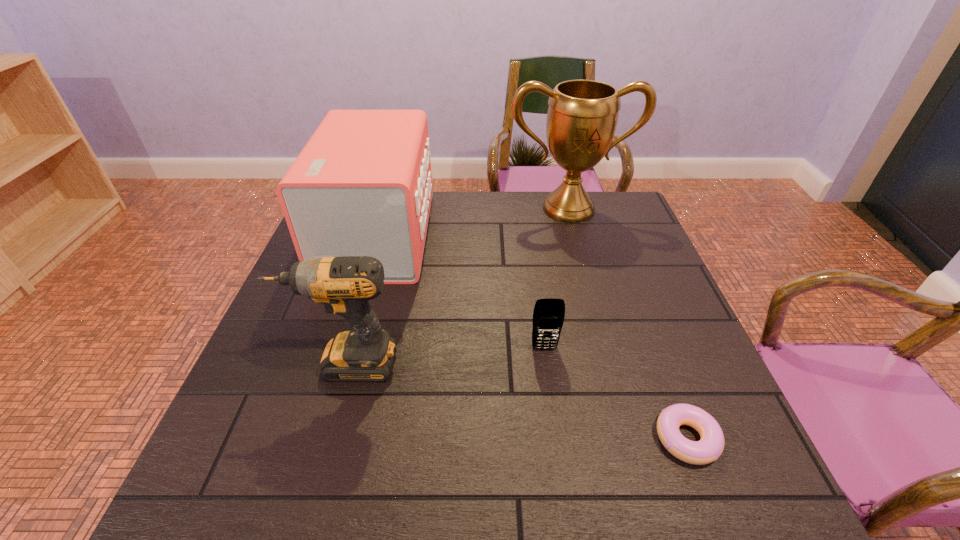
Where is `object that is at the far right corner`? Image resolution: width=960 pixels, height=540 pixels. object that is at the far right corner is located at coordinates (582, 116).

I want to click on object situated at the near right corner, so click(x=709, y=448).

You are a GUI agent. You are given a task and a screenshot of the screen. Output one action in this format:
    pyautogui.click(x=<x>, y=<y>)
    Task: Click on the vacant space at the far edge
    This screenshot has height=540, width=960.
    Given the screenshot: What is the action you would take?
    pyautogui.click(x=515, y=199)

Where is `vacant region at the left edge of the desktop`? This screenshot has width=960, height=540. vacant region at the left edge of the desktop is located at coordinates click(x=269, y=382).

Where is `free point at the right edge`? free point at the right edge is located at coordinates [x=628, y=273].

The height and width of the screenshot is (540, 960). I want to click on free space at the near left corner, so click(291, 471).

The image size is (960, 540). In the image, there is a desktop. What are the coordinates of `blank space at the near right corner` in the screenshot? It's located at (762, 483).

What are the coordinates of `empty location between the cellular telephone and the nearest object` in the screenshot? It's located at (615, 393).

Locate an element on the screen. empty space that is in between the cellular telephone and the trophy cup is located at coordinates (557, 279).

Identify the location of free space between the second shortest object and the drill. This screenshot has width=960, height=540. (444, 356).